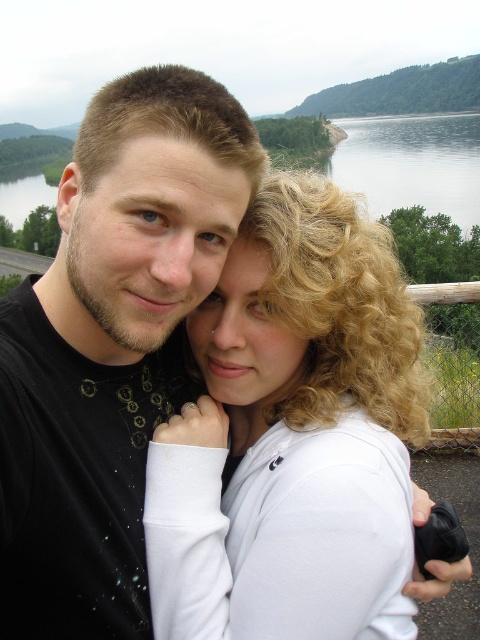
You are a photographer trying to capture a shot of the black matte shirt at center and the transparent water at upper center. Which object is positioned lower in the image?

The black matte shirt at center is located below transparent water at upper center, so the black matte shirt at center is positioned lower in the image.

You are an artist trying to paint this scene. You need to decide which object should be painted first based on their thickness. According to the description, which object should you paint first, the black matte shirt at center or the transparent water at upper center?

The black matte shirt at center is thinner than the transparent water at upper center, so you should paint the transparent water at upper center first since it is thicker and needs to be placed behind the thinner object.